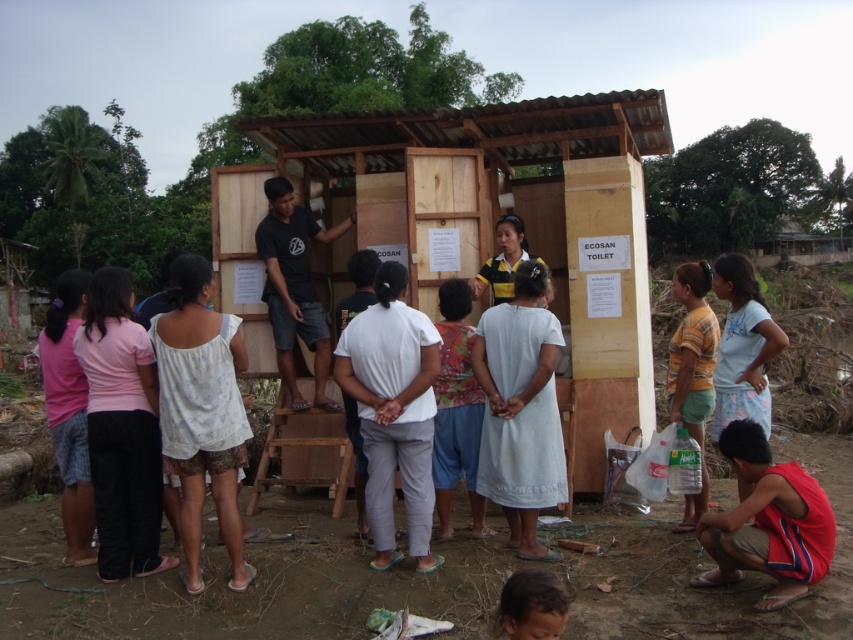
Question: Which point is farther to the camera?

Choices:
 (A) yellow-green fabric dress at right
 (B) brown hair at lower center

Answer: (A)

Question: Can you confirm if wooden shack at center is smaller than brown hair at lower center?

Choices:
 (A) yes
 (B) no

Answer: (B)

Question: Which object is positioned farthest from the brown hair at lower center?

Choices:
 (A) wooden shack at center
 (B) yellow-green fabric dress at right

Answer: (A)

Question: Does yellow-green fabric dress at right appear over brown hair at lower center?

Choices:
 (A) no
 (B) yes

Answer: (B)

Question: Can you confirm if wooden shack at center is bigger than brown hair at lower center?

Choices:
 (A) no
 (B) yes

Answer: (B)

Question: Which object appears closest to the camera in this image?

Choices:
 (A) brown hair at lower center
 (B) wooden shack at center
 (C) yellow-green fabric dress at right

Answer: (A)